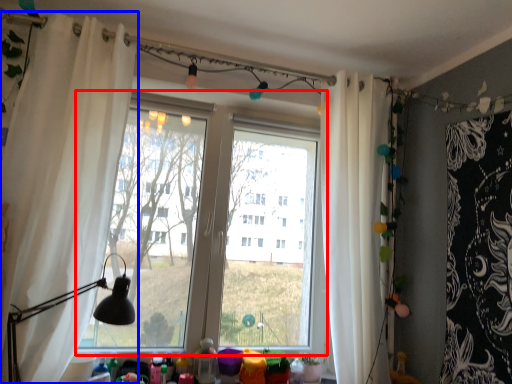
Question: Which object is closer to the camera taking this photo, window (highlighted by a red box) or curtain (highlighted by a blue box)?

Choices:
 (A) window
 (B) curtain

Answer: (B)